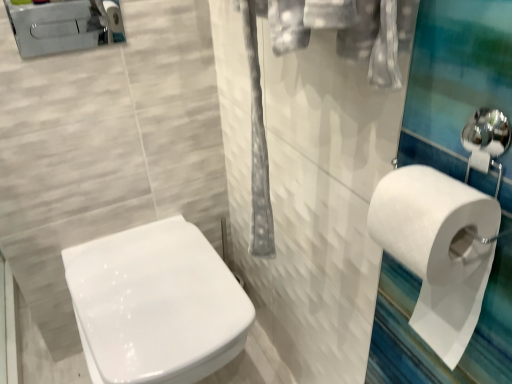
Describe the element at coordinates (156, 305) in the screenshot. The width and height of the screenshot is (512, 384). I see `white glossy toilet at center` at that location.

This screenshot has width=512, height=384. Describe the element at coordinates (438, 249) in the screenshot. I see `white matte toilet paper at right` at that location.

Where is `brushed metal toilet at upper left`? The height and width of the screenshot is (384, 512). brushed metal toilet at upper left is located at coordinates (63, 25).

Find the location of a particular element. The height and width of the screenshot is (384, 512). white glossy toilet at center is located at coordinates (156, 305).

How different are the orientations of brushed metal toilet at upper left and white glossy toilet at center in degrees?

There is a 0.984-degree angle between the facing directions of brushed metal toilet at upper left and white glossy toilet at center.

Can you confirm if brushed metal toilet at upper left is positioned to the left of white glossy toilet at center?

Yes, brushed metal toilet at upper left is to the left of white glossy toilet at center.

Is brushed metal toilet at upper left looking in the opposite direction of white glossy toilet at center?

brushed metal toilet at upper left is not turned away from white glossy toilet at center.

Is brushed metal toilet at upper left taller than white glossy toilet at center?

No, brushed metal toilet at upper left is not taller than white glossy toilet at center.

From the image's perspective, is white matte toilet paper at right on top of white glossy toilet at center?

Yes, from the image's perspective, white matte toilet paper at right is over white glossy toilet at center.

Could you tell me if white matte toilet paper at right is turned towards white glossy toilet at center?

A: No.

Is white matte toilet paper at right positioned far away from white glossy toilet at center?

No, white matte toilet paper at right is in close proximity to white glossy toilet at center.

Locate an element on the screen. toilet paper located in front of the white glossy toilet at center is located at coordinates (438, 249).

Between white glossy toilet at center and white matte toilet paper at right, which one has smaller width?

Thinner between the two is white matte toilet paper at right.

Is white glossy toilet at center turned away from white matte toilet paper at right?

white glossy toilet at center is not turned away from white matte toilet paper at right.

Which of these two, white glossy toilet at center or white matte toilet paper at right, stands taller?

Standing taller between the two is white glossy toilet at center.

In the scene shown: From the image's perspective, which one is positioned higher, white glossy toilet at center or white matte toilet paper at right?

white matte toilet paper at right.

From the image's perspective, relative to white matte toilet paper at right, is brushed metal toilet at upper left above or below?

brushed metal toilet at upper left is situated higher than white matte toilet paper at right in the image.

Is brushed metal toilet at upper left directly adjacent to white matte toilet paper at right?

No, brushed metal toilet at upper left is not making contact with white matte toilet paper at right.

Which object is more forward, brushed metal toilet at upper left or white matte toilet paper at right?

white matte toilet paper at right is in front.

Is point (62, 4) less distant than point (455, 201)?

No, (62, 4) is further to viewer.

Does white matte toilet paper at right lie in front of brushed metal toilet at upper left?

Yes, it is in front of brushed metal toilet at upper left.

Image resolution: width=512 pixels, height=384 pixels. What are the coordinates of `porcelain that appears on the left of white matte toilet paper at right` in the screenshot? It's located at (63, 25).

What's the angular difference between white matte toilet paper at right and brushed metal toilet at upper left's facing directions?

There is a 89.2-degree angle between the facing directions of white matte toilet paper at right and brushed metal toilet at upper left.

Would you say white matte toilet paper at right is inside or outside brushed metal toilet at upper left?

white matte toilet paper at right is not inside brushed metal toilet at upper left, it's outside.

In the scene shown: Is white glossy toilet at center taller than brushed metal toilet at upper left?

Correct, white glossy toilet at center is much taller as brushed metal toilet at upper left.

Is white glossy toilet at center not inside brushed metal toilet at upper left?

Indeed, white glossy toilet at center is completely outside brushed metal toilet at upper left.

From a real-world perspective, is white glossy toilet at center positioned over brushed metal toilet at upper left based on gravity?

No, from a real-world perspective, white glossy toilet at center is not over brushed metal toilet at upper left

Find the location of `toilet that appears in front of the brushed metal toilet at upper left`. toilet that appears in front of the brushed metal toilet at upper left is located at coordinates (156, 305).

You are a GUI agent. You are given a task and a screenshot of the screen. Output one action in this format:
    pyautogui.click(x=<x>, y=<y>)
    Task: Click on the porcelain that is on the left side of white glossy toilet at center
    
    Given the screenshot: What is the action you would take?
    pyautogui.click(x=63, y=25)

The width and height of the screenshot is (512, 384). In order to click on toilet that appears below the white matte toilet paper at right (from the image's perspective) in this screenshot , I will do `click(156, 305)`.

Considering their positions, is white matte toilet paper at right positioned further to brushed metal toilet at upper left than white glossy toilet at center?

The object further to brushed metal toilet at upper left is white matte toilet paper at right.

From the image, which object appears to be farther from white matte toilet paper at right, white glossy toilet at center or brushed metal toilet at upper left?

Based on the image, brushed metal toilet at upper left appears to be further to white matte toilet paper at right.

Considering their positions, is brushed metal toilet at upper left positioned further to white matte toilet paper at right than white glossy toilet at center?

Based on the image, brushed metal toilet at upper left appears to be further to white matte toilet paper at right.

Considering their positions, is white matte toilet paper at right positioned closer to white glossy toilet at center than brushed metal toilet at upper left?

white matte toilet paper at right lies closer to white glossy toilet at center than the other object.

Estimate the real-world distances between objects in this image. Which object is further from brushed metal toilet at upper left, white glossy toilet at center or white matte toilet paper at right?

→ white matte toilet paper at right is positioned further to the anchor brushed metal toilet at upper left.

Which object lies nearer to the anchor point white glossy toilet at center, brushed metal toilet at upper left or white matte toilet paper at right?

Among the two, white matte toilet paper at right is located nearer to white glossy toilet at center.

Locate an element on the screen. This screenshot has width=512, height=384. toilet paper between brushed metal toilet at upper left and white glossy toilet at center vertically is located at coordinates (438, 249).